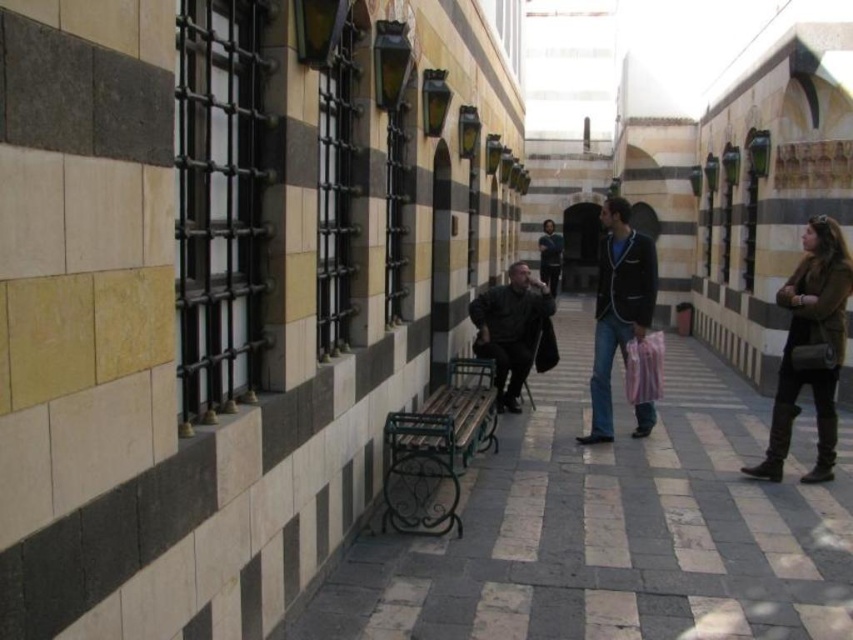
Which is below, smooth stone pavement at center or dark blue jacket at center?

smooth stone pavement at center is lower down.

Which is above, smooth stone pavement at center or dark blue jacket at center?

Positioned higher is dark blue jacket at center.

Is point (723, 438) closer to viewer compared to point (549, 260)?

Yes.

The image size is (853, 640). What are the coordinates of `smooth stone pavement at center` in the screenshot? It's located at (616, 525).

The width and height of the screenshot is (853, 640). What do you see at coordinates (618, 307) in the screenshot?
I see `blue denim jeans at center` at bounding box center [618, 307].

Is blue denim jeans at center smaller than dark gray fabric jacket at center?

No.

Does point (625, 336) lie in front of point (503, 337)?

Yes, point (625, 336) is in front of point (503, 337).

The image size is (853, 640). What are the coordinates of `blue denim jeans at center` in the screenshot? It's located at (618, 307).

Which of these two, smooth stone pavement at center or blue denim jeans at center, stands shorter?

smooth stone pavement at center

Does smooth stone pavement at center appear on the right side of blue denim jeans at center?

Incorrect, smooth stone pavement at center is not on the right side of blue denim jeans at center.

The image size is (853, 640). Identify the location of smooth stone pavement at center. (616, 525).